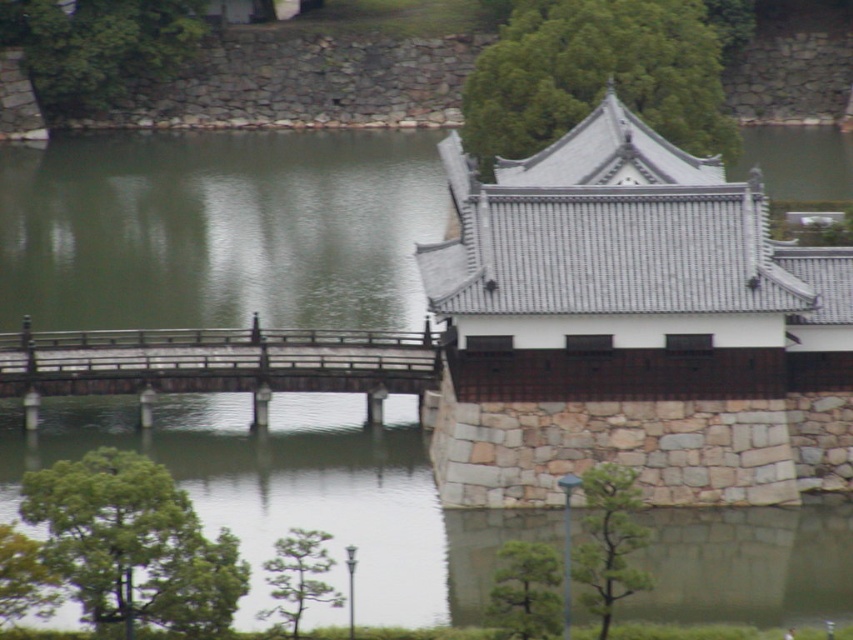
Question: Does stone tiled roof at upper right have a smaller size compared to wooden bridge at center?

Choices:
 (A) yes
 (B) no

Answer: (B)

Question: Where is stone tiled roof at upper right located in relation to wooden bridge at center in the image?

Choices:
 (A) left
 (B) right

Answer: (B)

Question: Is stone tiled roof at upper right below wooden bridge at center?

Choices:
 (A) yes
 (B) no

Answer: (B)